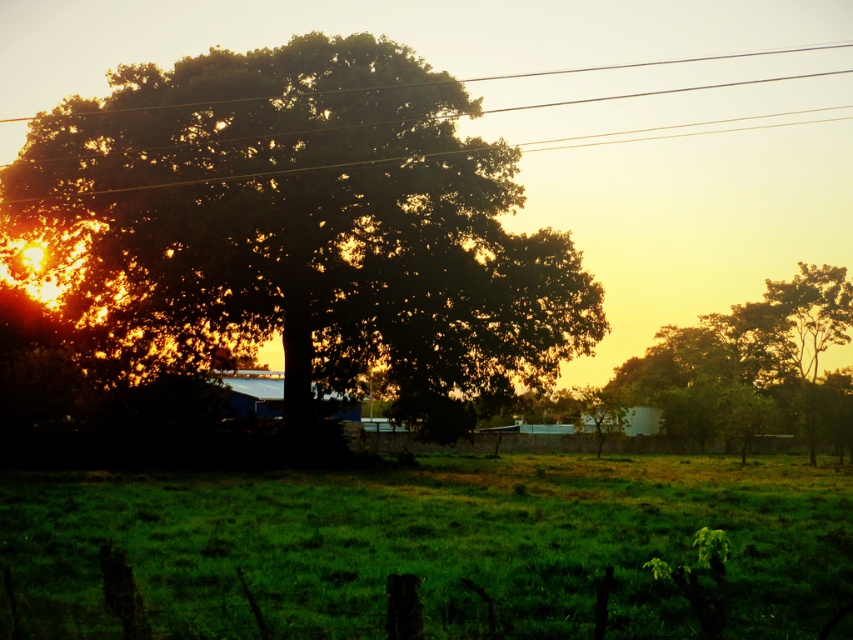
How distant is green leafy tree at center from metallic wires at upper center?

A distance of 24.25 feet exists between green leafy tree at center and metallic wires at upper center.

What do you see at coordinates (294, 230) in the screenshot? I see `green leafy tree at center` at bounding box center [294, 230].

This screenshot has width=853, height=640. I want to click on green leafy tree at center, so click(294, 230).

Locate an element on the screen. This screenshot has height=640, width=853. green leafy tree at center is located at coordinates (294, 230).

Is green leafy tree at center bigger than green grassy field at center?

Indeed, green leafy tree at center has a larger size compared to green grassy field at center.

Does point (343, 368) lie behind point (552, 618)?

Yes.

Locate an element on the screen. Image resolution: width=853 pixels, height=640 pixels. green leafy tree at center is located at coordinates (294, 230).

Is green leafy tree at right wider than metallic wires at upper center?

No, green leafy tree at right is not wider than metallic wires at upper center.

Is green leafy tree at right further to the viewer compared to metallic wires at upper center?

Yes, green leafy tree at right is behind metallic wires at upper center.

Which is in front, point (791, 292) or point (788, 49)?

Point (791, 292)

The image size is (853, 640). Identify the location of green leafy tree at right. click(x=749, y=362).